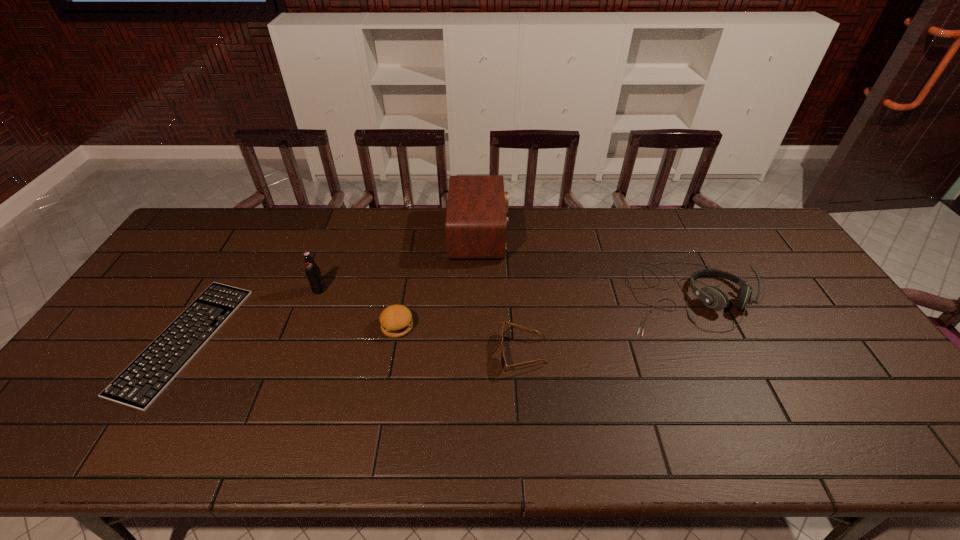
This screenshot has width=960, height=540. I want to click on radio receiver, so click(x=476, y=224).

The height and width of the screenshot is (540, 960). Find the location of `the fifth object from right to left`. the fifth object from right to left is located at coordinates (312, 271).

Image resolution: width=960 pixels, height=540 pixels. What are the coordinates of `headset` in the screenshot? It's located at (714, 298).

You are a GUI agent. You are given a task and a screenshot of the screen. Output one action in this format:
    pyautogui.click(x=<x>, y=<y>)
    Task: Click on the rightmost object
    
    Given the screenshot: What is the action you would take?
    pyautogui.click(x=714, y=298)

In order to click on the fourth tallest object in this screenshot , I will do `click(396, 321)`.

Find the location of a particular element. hamburger is located at coordinates (396, 321).

Find the location of a particular element. Image resolution: width=960 pixels, height=540 pixels. the fifth tallest object is located at coordinates (503, 363).

Find the location of a particular element. The width and height of the screenshot is (960, 540). the leftmost object is located at coordinates (138, 386).

Find the location of a particular element. the shortest object is located at coordinates (138, 386).

Identify the location of free space located 0.340m on the front panel of the radio receiver. (608, 235).